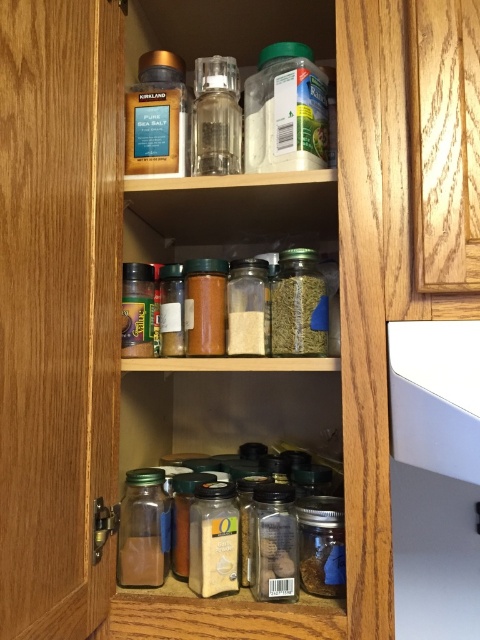
Question: Which of the following is the closest to the observer?

Choices:
 (A) translucent glass spice jar at center
 (B) translucent glass jar at center

Answer: (B)

Question: Is translucent glass jar at center positioned behind transparent glass jar at center?

Choices:
 (A) yes
 (B) no

Answer: (A)

Question: Observing the image, what is the correct spatial positioning of transparent glass jar at center in reference to translucent glass spice jar at center?

Choices:
 (A) below
 (B) above

Answer: (A)

Question: Which point appears farthest from the camera in this image?

Choices:
 (A) (147, 506)
 (B) (263, 580)
 (C) (324, 554)

Answer: (A)

Question: Among these objects, which one is farthest from the camera?

Choices:
 (A) transparent glass grinder at center
 (B) transparent glass jar at center
 (C) translucent glass jars at center

Answer: (A)

Question: Can you confirm if transparent glass jar at lower center is smaller than translucent glass jar at center?

Choices:
 (A) yes
 (B) no

Answer: (A)